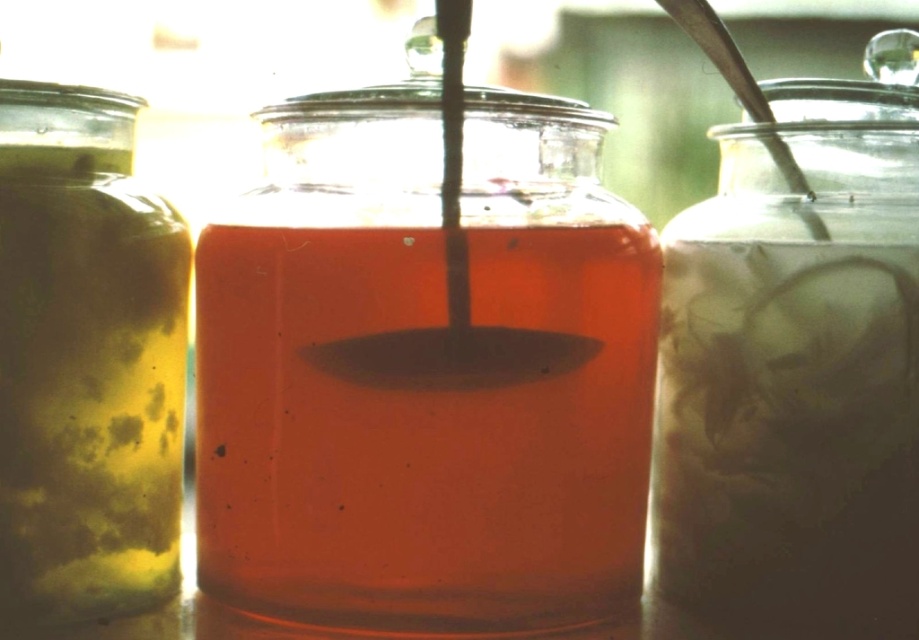
Question: Is translucent glass jar at center below matte yellow glass jar at left?

Choices:
 (A) yes
 (B) no

Answer: (B)

Question: Does translucent glass jar at center appear under matte yellow glass jar at left?

Choices:
 (A) no
 (B) yes

Answer: (A)

Question: Which of these objects is positioned farthest from the translucent glass jar at center?

Choices:
 (A) matte yellow glass jar at left
 (B) translucent glass jar at right

Answer: (B)

Question: Which object is the closest to the translucent glass jar at right?

Choices:
 (A) translucent glass jar at center
 (B) matte yellow glass jar at left

Answer: (A)

Question: Which of the following is the closest to the observer?

Choices:
 (A) (29, 540)
 (B) (430, 243)

Answer: (B)

Question: Can you confirm if translucent glass jar at right is positioned below matte yellow glass jar at left?

Choices:
 (A) yes
 (B) no

Answer: (B)